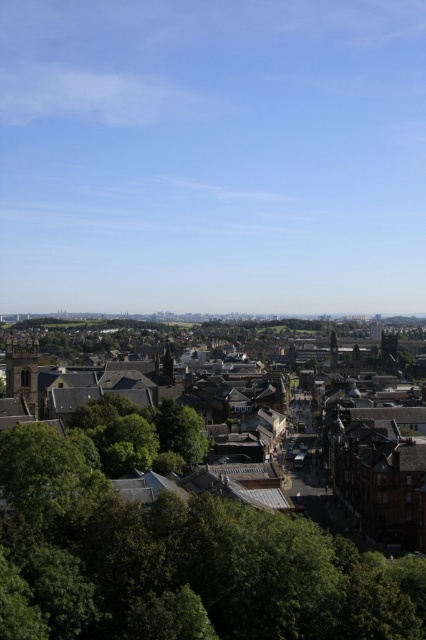
You are an architect analyzing the cityscape. You observe the brown stone tower at left and the brown stone tower at center. Which one has a greater height?

The brown stone tower at left is much taller than the brown stone tower at center, so the one at left has a greater height.

You are standing in the city park and see the green leafy tree at lower left and the brown stone tower at left. Which object is positioned more to the east if the sun is setting in the west?

The brown stone tower at left is positioned more to the east because it is to the left of the green leafy tree at lower left, and since the sun is setting in the west, the left side of the image faces east.